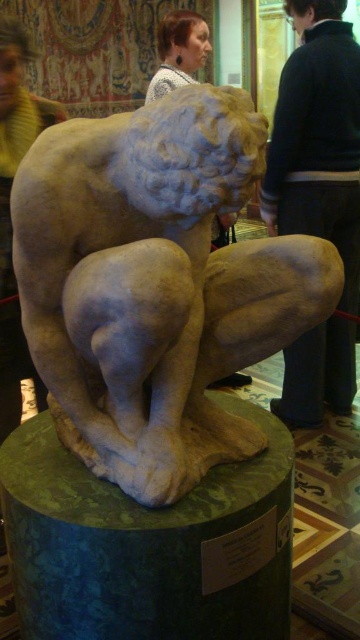
Can you confirm if dark blue sweater at upper center is positioned above light brown hair at upper center?

No.

Is dark blue sweater at upper center shorter than light brown hair at upper center?

No, dark blue sweater at upper center is not shorter than light brown hair at upper center.

Between point (266, 192) and point (208, 29), which one is positioned behind?

The point (208, 29) is behind.

The width and height of the screenshot is (360, 640). What are the coordinates of `dark blue sweater at upper center` in the screenshot? It's located at (317, 138).

Who is shorter, white marble statue at center or light brown hair at upper center?

With less height is light brown hair at upper center.

I want to click on white marble statue at center, so click(x=155, y=284).

At what (x,y) coordinates should I click in order to perform the action: click on white marble statue at center. Please return your answer as a coordinate pair (x, y). The image size is (360, 640). Looking at the image, I should click on (155, 284).

Can you confirm if white marble statue at center is positioned above green marble pedestal at center?

Indeed, white marble statue at center is positioned over green marble pedestal at center.

Does white marble statue at center have a greater height compared to green marble pedestal at center?

Indeed, white marble statue at center has a greater height compared to green marble pedestal at center.

Locate an element on the screen. This screenshot has width=360, height=640. white marble statue at center is located at coordinates (155, 284).